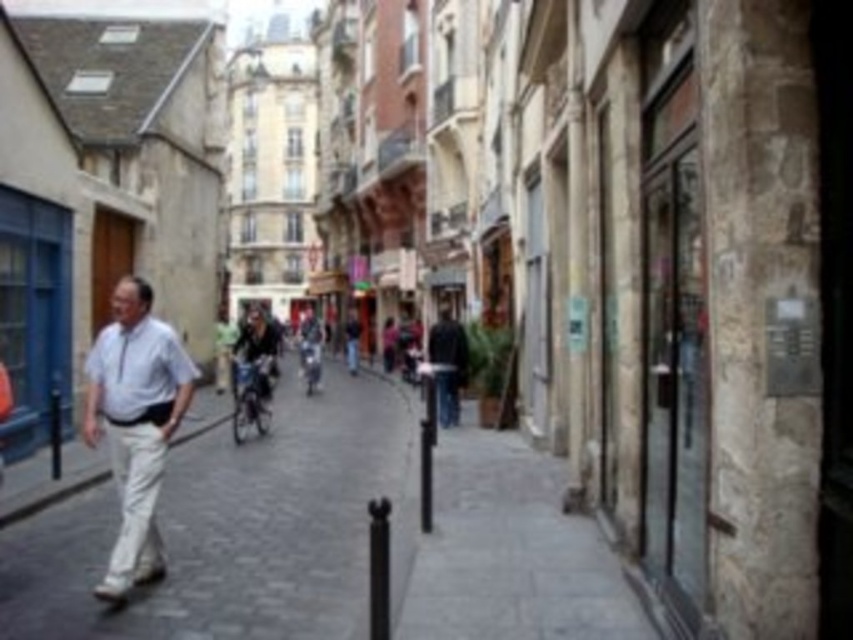
Does point (447, 404) come closer to viewer compared to point (306, 369)?

Yes, point (447, 404) is closer to viewer.

Is point (454, 378) closer to viewer compared to point (321, 337)?

Yes, it is.

This screenshot has width=853, height=640. I want to click on dark blue jacket at center, so click(448, 364).

Which is behind, point (119, 579) or point (432, 333)?

The point (432, 333) is behind.

Is point (178, 348) closer to camera compared to point (461, 330)?

Yes, it is.

Identify the location of white cotton shirt at center. (135, 422).

Is white cotton shirt at center to the right of matte gray jacket at center from the viewer's perspective?

In fact, white cotton shirt at center is to the left of matte gray jacket at center.

Describe the element at coordinates (135, 422) in the screenshot. I see `white cotton shirt at center` at that location.

Is point (160, 556) closer to viewer compared to point (303, 349)?

Yes.

At what (x,y) coordinates should I click in order to perform the action: click on white cotton shirt at center. Please return your answer as a coordinate pair (x, y). The height and width of the screenshot is (640, 853). Looking at the image, I should click on (135, 422).